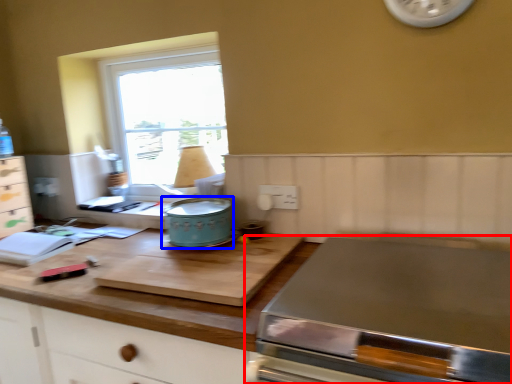
Question: Which point is closer to the camera, home appliance (highlighted by a red box) or appliance (highlighted by a blue box)?

Choices:
 (A) home appliance
 (B) appliance

Answer: (A)